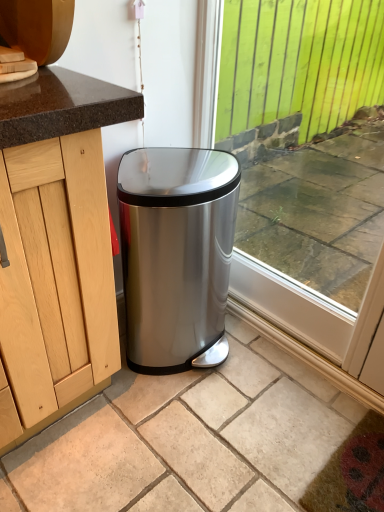
Question: Choose the correct answer: Is satin metallic trash can at lower center inside transparent glass window at center or outside it?

Choices:
 (A) inside
 (B) outside

Answer: (B)

Question: In terms of width, does satin metallic trash can at lower center look wider or thinner when compared to transparent glass window at center?

Choices:
 (A) thin
 (B) wide

Answer: (B)

Question: Considering the positions of point (59, 446) and point (231, 91), is point (59, 446) closer or farther from the camera than point (231, 91)?

Choices:
 (A) closer
 (B) farther

Answer: (A)

Question: From the image's perspective, is transparent glass window at center located above or below satin metallic trash can at lower center?

Choices:
 (A) below
 (B) above

Answer: (B)

Question: Is transparent glass window at center situated inside satin metallic trash can at lower center or outside?

Choices:
 (A) outside
 (B) inside

Answer: (A)

Question: Is transparent glass window at center bigger or smaller than satin metallic trash can at lower center?

Choices:
 (A) small
 (B) big

Answer: (B)

Question: From a real-world perspective, is transparent glass window at center positioned above or below satin metallic trash can at lower center?

Choices:
 (A) below
 (B) above

Answer: (B)